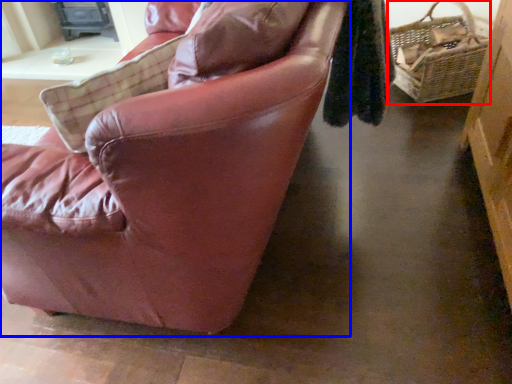
Question: Which object appears closest to the camera in this image, picnic basket (highlighted by a red box) or chair (highlighted by a blue box)?

Choices:
 (A) picnic basket
 (B) chair

Answer: (B)